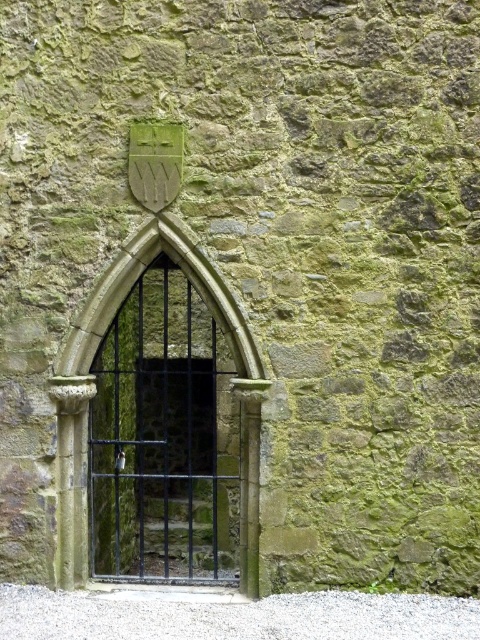
Can you confirm if white gravel at bottom is positioned below black metal gate at center?

Yes.

Which is behind, point (100, 618) or point (202, 285)?

The point (202, 285) is behind.

Locate an element on the screen. The image size is (480, 640). white gravel at bottom is located at coordinates (232, 616).